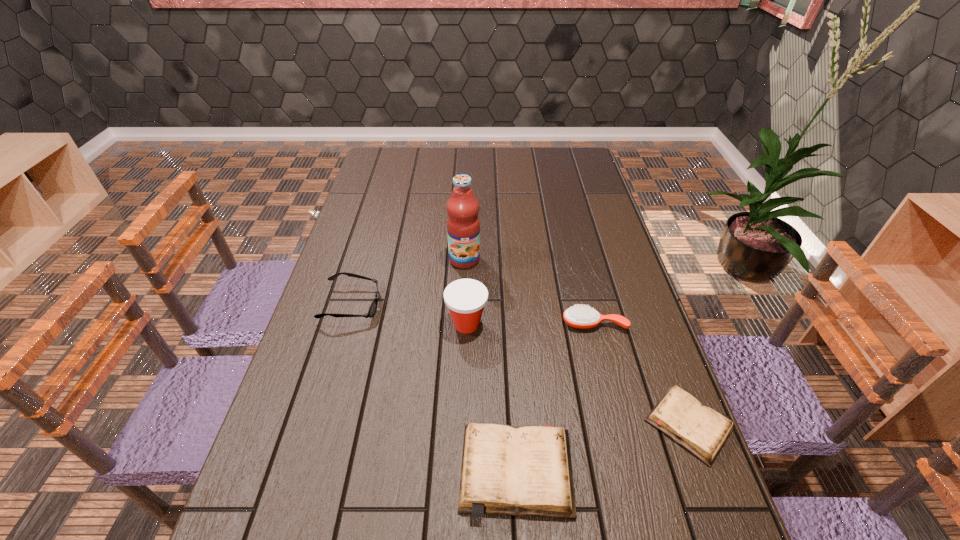
Locate an element on the screen. The height and width of the screenshot is (540, 960). vacant region that satisfies the following two spatial constraints: 1. on the front label of the second shortest object; 2. on the left side of the tallest object is located at coordinates (456, 471).

At what (x,y) coordinates should I click in order to perform the action: click on blank area in the image that satisfies the following two spatial constraints: 1. on the front label of the farthest object; 2. on the left side of the hairbrush. Please return your answer as a coordinate pair (x, y). This screenshot has height=540, width=960. Looking at the image, I should click on (462, 323).

Where is `blank area in the image that satisfies the following two spatial constraints: 1. on the lenses of the sunglasses; 2. on the back side of the right diary`? This screenshot has height=540, width=960. blank area in the image that satisfies the following two spatial constraints: 1. on the lenses of the sunglasses; 2. on the back side of the right diary is located at coordinates (317, 425).

At what (x,y) coordinates should I click in order to perform the action: click on vacant region that satisfies the following two spatial constraints: 1. on the front side of the shortest object; 2. on the left side of the hairbrush. Please return your answer as a coordinate pair (x, y). Looking at the image, I should click on (619, 425).

Identify the location of free spot that satisfies the following two spatial constraints: 1. on the front label of the hairbrush; 2. on the right side of the fruit juice. (462, 323).